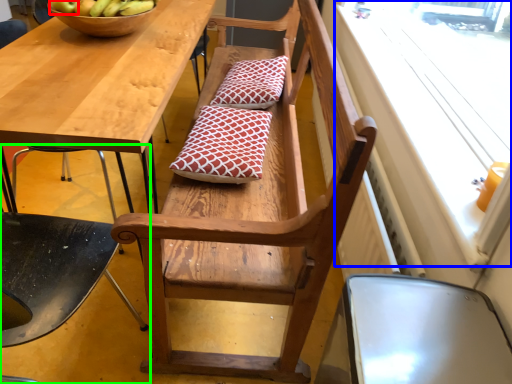
Question: Which object is positioned farthest from apple (highlighted by a red box)? Select from window screen (highlighted by a blue box) and chair (highlighted by a green box).

Choices:
 (A) window screen
 (B) chair

Answer: (A)